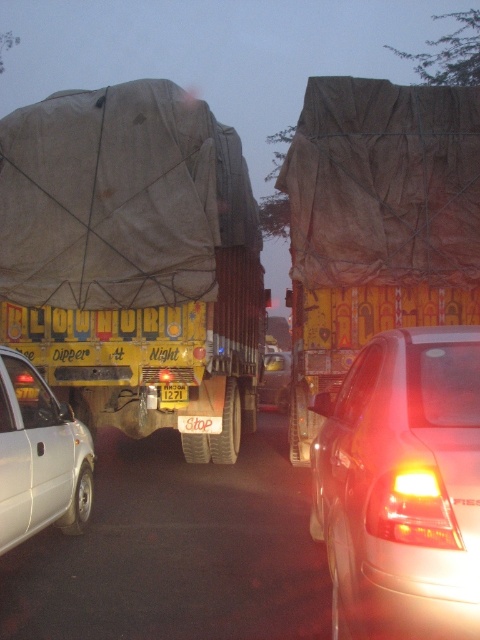
You are a delivery driver who needs to park your vehicle in a space that can only accommodate vehicles up to the height of the yellow matte car at center. You are driving a vehicle similar in height to the brown tarpaulin truck at center. Will your vehicle fit in the parking space?

The brown tarpaulin truck at center is taller than the yellow matte car at center, so your vehicle will not fit in the parking space since it is taller than the allowed height.

You are a pedestrian standing at the edge of the road. You see the brown tarpaulin truck at center and the white matte car at lower left. Which vehicle is closer to your right side?

The brown tarpaulin truck at center is to the right of white matte car at lower left, so the brown tarpaulin truck at center is closer to your right side.

You are a pedestrian standing at the edge of the road. You see the brown tarpaulin truck at center and the white matte car at lower left. Which vehicle should you avoid stepping in front of if they suddenly start moving?

You should avoid stepping in front of the brown tarpaulin truck at center because it is bigger than the white matte car at lower left and may take longer to stop, posing a greater risk.